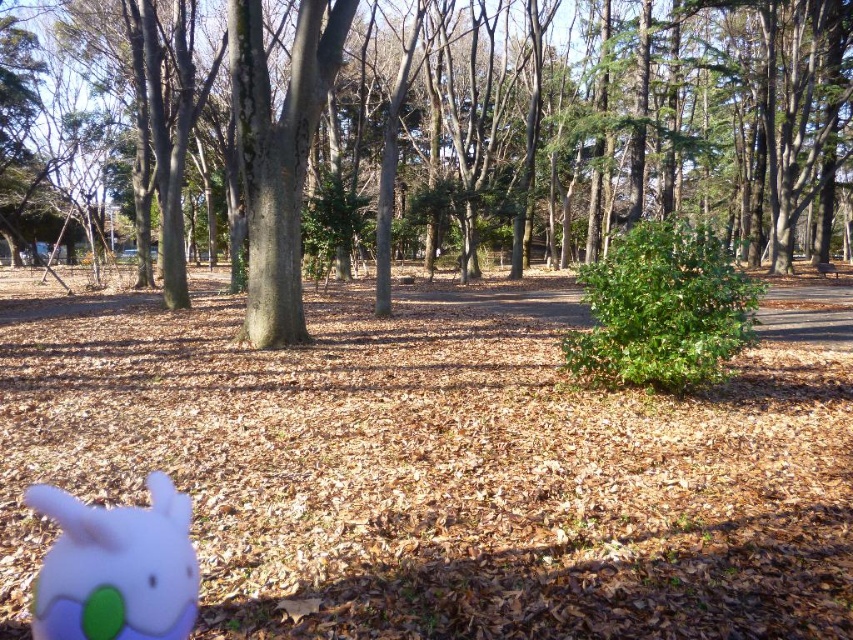
Which is in front, point (199, 147) or point (151, 561)?

Point (151, 561) is in front.

Can you confirm if brown textured tree at center is taller than white matte plush toy at lower left?

Indeed, brown textured tree at center has a greater height compared to white matte plush toy at lower left.

Which is in front, point (144, 202) or point (105, 625)?

Point (105, 625) is more forward.

You are a GUI agent. You are given a task and a screenshot of the screen. Output one action in this format:
    pyautogui.click(x=<x>, y=<y>)
    Task: Click on the brown textured tree at center
    
    Given the screenshot: What is the action you would take?
    pyautogui.click(x=466, y=131)